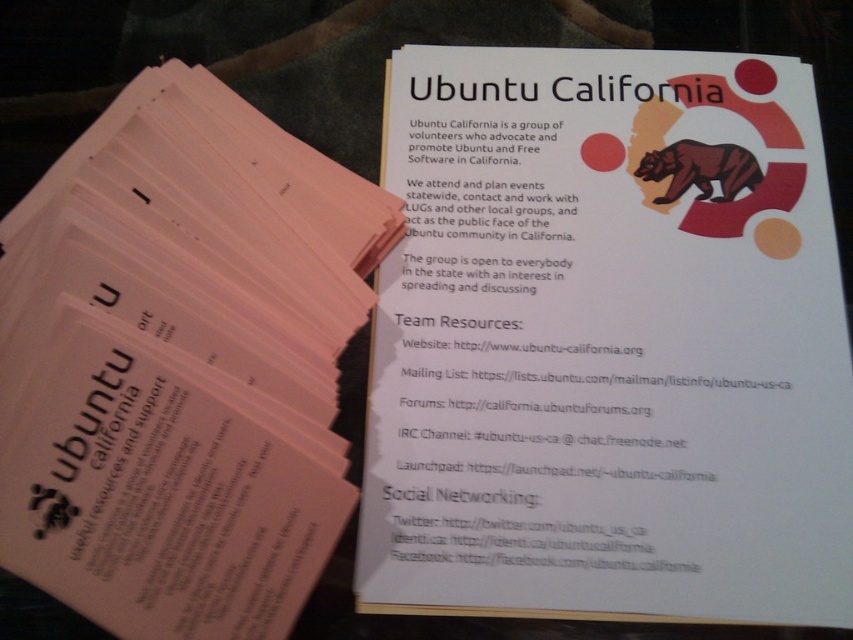
The image size is (853, 640). What do you see at coordinates (608, 342) in the screenshot?
I see `white paper at upper center` at bounding box center [608, 342].

Is point (553, 109) closer to viewer compared to point (308, 157)?

That is False.

Locate an element on the screen. This screenshot has width=853, height=640. white paper at upper center is located at coordinates (608, 342).